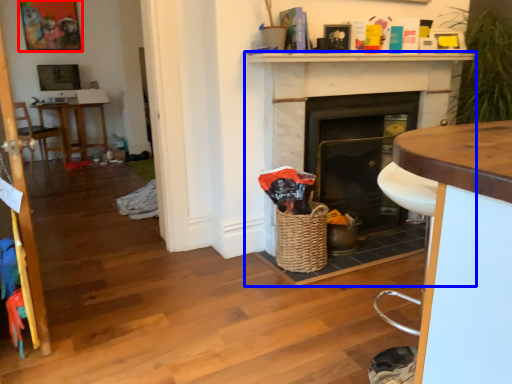
Question: Which object appears closest to the camera in this image, picture frame (highlighted by a red box) or fireplace (highlighted by a blue box)?

Choices:
 (A) picture frame
 (B) fireplace

Answer: (B)